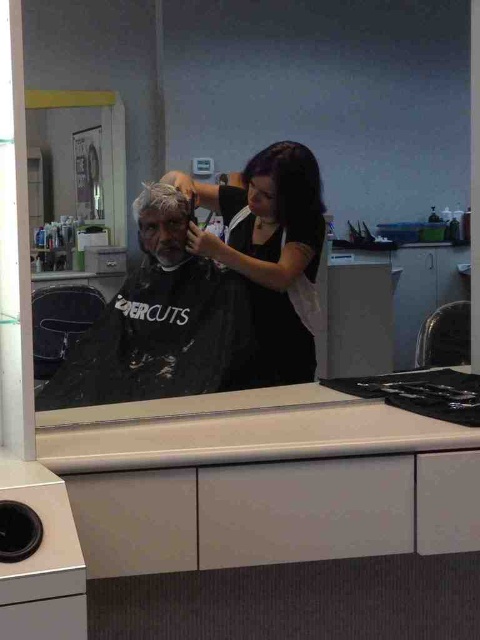
You are a customer in the barbershop and want to choose a color between the dark purple hair at center and the white matte hair at upper center. Which color option has a wider strand width?

The dark purple hair at center has a greater width than the white matte hair at upper center, so the dark purple hair at center has a wider strand width.

What is the location of the point with coordinates (158, 323) in the image?

The point with coordinates (158, 323) is located on the black matte cape at center.